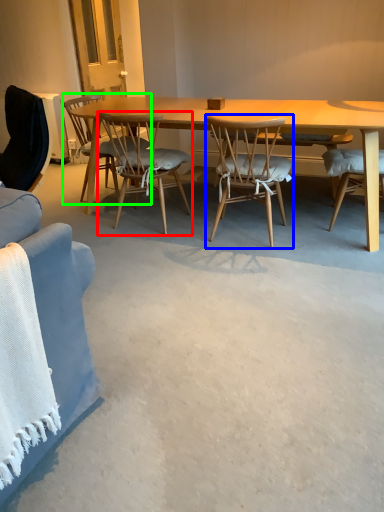
Question: Based on their relative distances, which object is farther from chair (highlighted by a red box)? Choose from chair (highlighted by a blue box) and chair (highlighted by a green box).

Choices:
 (A) chair
 (B) chair

Answer: (A)